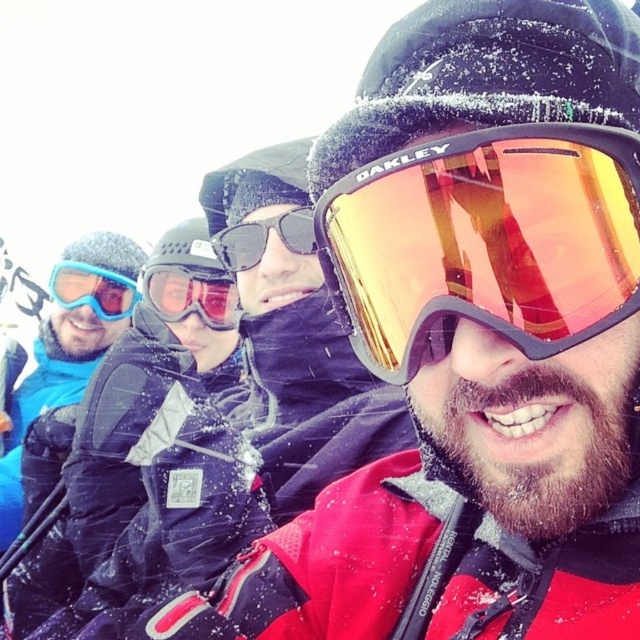
Question: Can you confirm if gold reflective oakley goggles at center is positioned below matte blue goggles at left?

Choices:
 (A) yes
 (B) no

Answer: (A)

Question: Which of these objects is positioned farthest from the matte blue goggles at left?

Choices:
 (A) matte black jacket at center
 (B) matte red ski goggles at center
 (C) gold reflective oakley goggles at center
 (D) matte black sunglasses at center

Answer: (C)

Question: Observing the image, what is the correct spatial positioning of gold reflective oakley goggles at center in reference to matte black jacket at center?

Choices:
 (A) left
 (B) right

Answer: (B)

Question: Which object is positioned closest to the matte black sunglasses at center?

Choices:
 (A) gold reflective oakley goggles at center
 (B) matte black jacket at center

Answer: (B)

Question: Which of the following is the farthest from the observer?

Choices:
 (A) matte blue goggles at left
 (B) matte black jacket at center

Answer: (A)

Question: Is the position of matte red ski goggles at center more distant than that of matte black sunglasses at center?

Choices:
 (A) yes
 (B) no

Answer: (A)